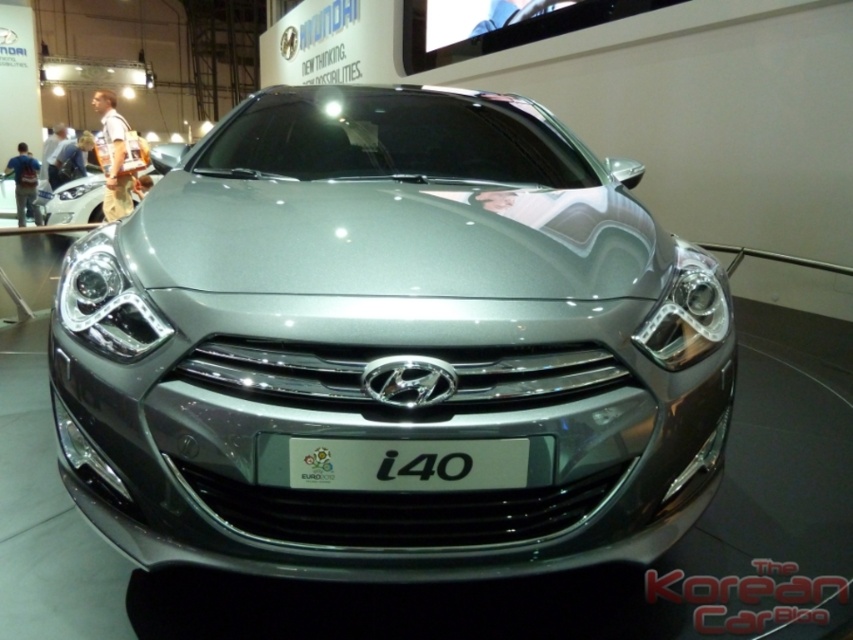
From the picture: You are standing in an auto show and see the Hyundai i40 car at center. There is a point marked at coordinates (392, 346). What object is this point located on?

The point marked at coordinates (392, 346) is located on the satin silver car at center.

You are a photographer at an auto show. You need to take a photo of the satin silver car at center and the sleek chrome headlight at center. Can you see both objects clearly in the same frame?

The satin silver car at center is in front of the sleek chrome headlight at center, so the car may block the view of the headlight in the photo, making it difficult to see both clearly in the same frame.